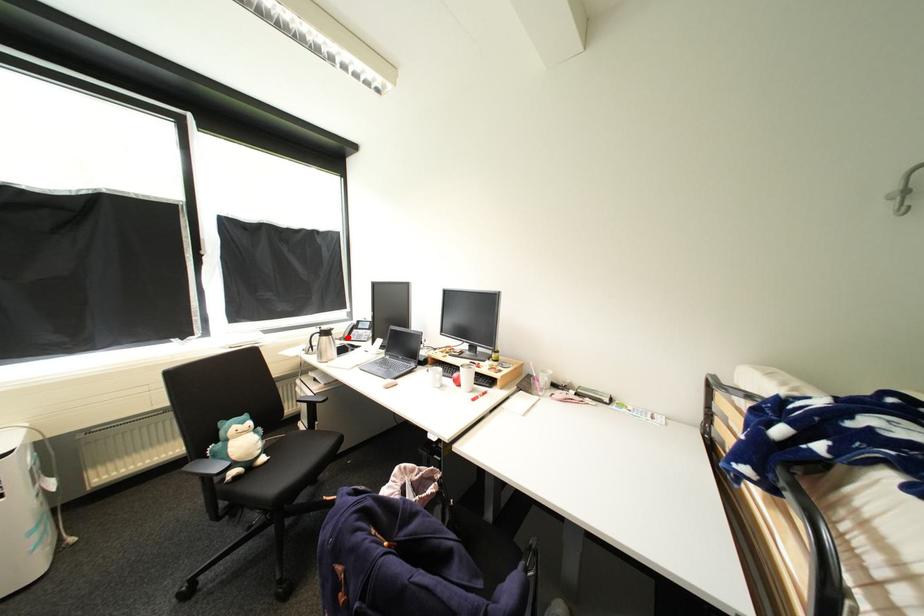
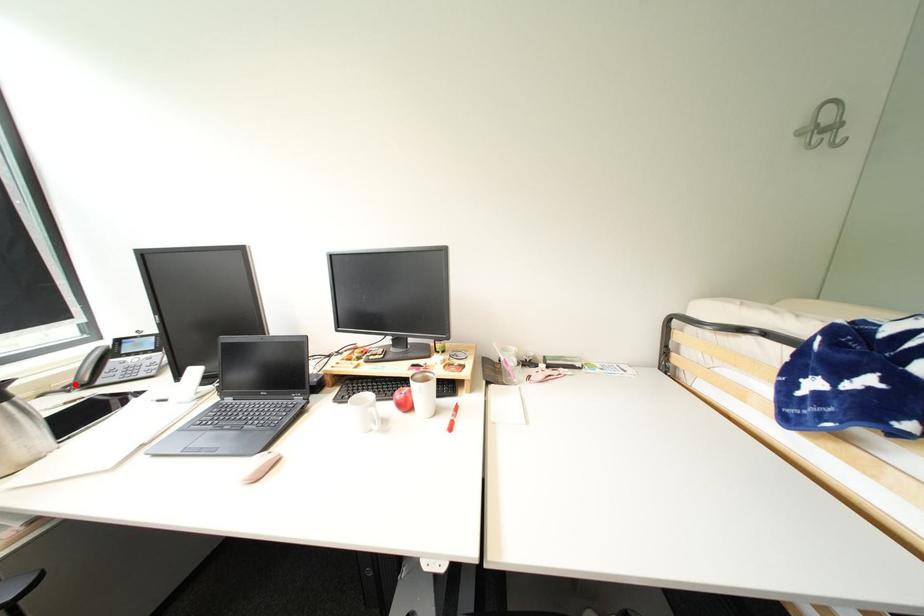
I am providing you with two images of the same scene from different viewpoints. A red point is marked on the first image and another point is marked on the second image. Is the red point in image1 aligned with the point shown in image2?

Yes